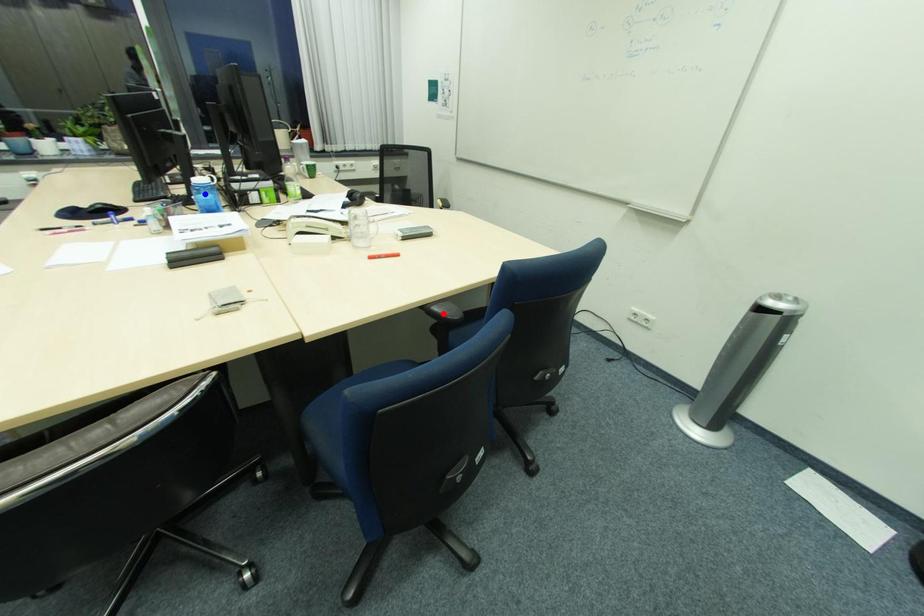
Question: Two points are marked on the image. Which point is closer to the camera?

Choices:
 (A) Blue point is closer.
 (B) Red point is closer.

Answer: (B)